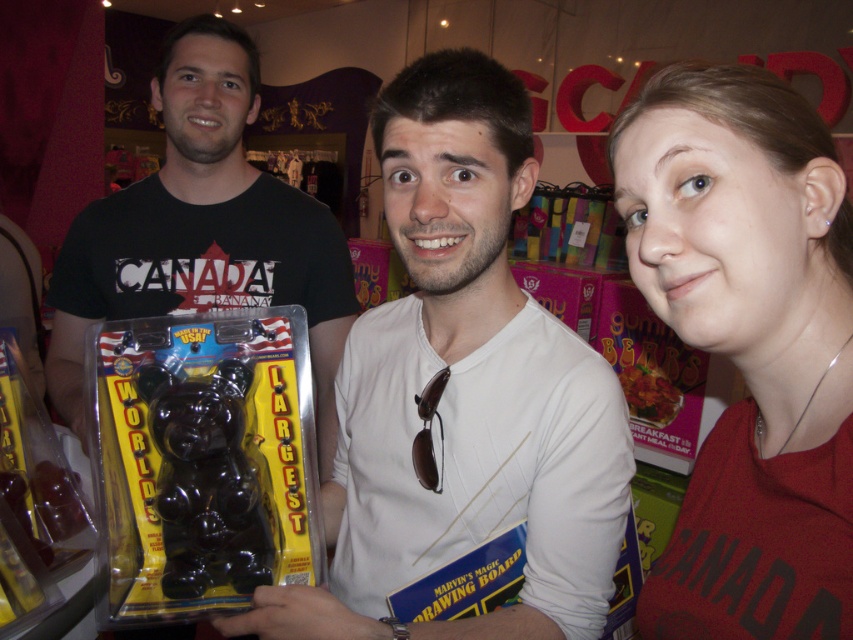
Is matte red shirt at center to the right of black matte bear at left from the viewer's perspective?

Indeed, matte red shirt at center is positioned on the right side of black matte bear at left.

The height and width of the screenshot is (640, 853). What do you see at coordinates (747, 346) in the screenshot?
I see `matte red shirt at center` at bounding box center [747, 346].

Is point (689, 305) farther from camera compared to point (247, 180)?

No.

Locate an element on the screen. This screenshot has width=853, height=640. matte red shirt at center is located at coordinates (747, 346).

Is point (192, 128) closer to viewer compared to point (223, 410)?

No, (192, 128) is behind (223, 410).

Who is more forward, (221, 106) or (241, 532)?

Point (241, 532)

Based on the photo, who is more forward, (149, 292) or (173, 410)?

Point (173, 410) is in front.

Where is `black matte bear at left`? The image size is (853, 640). black matte bear at left is located at coordinates (202, 228).

Does matte black gummy bear at center appear on the right side of glossy plastic bear at center?

Indeed, matte black gummy bear at center is positioned on the right side of glossy plastic bear at center.

Does matte black gummy bear at center have a greater width compared to glossy plastic bear at center?

Yes.

Find the location of a particular element. The image size is (853, 640). matte black gummy bear at center is located at coordinates (462, 392).

Identify the location of matte black gummy bear at center. Image resolution: width=853 pixels, height=640 pixels. (462, 392).